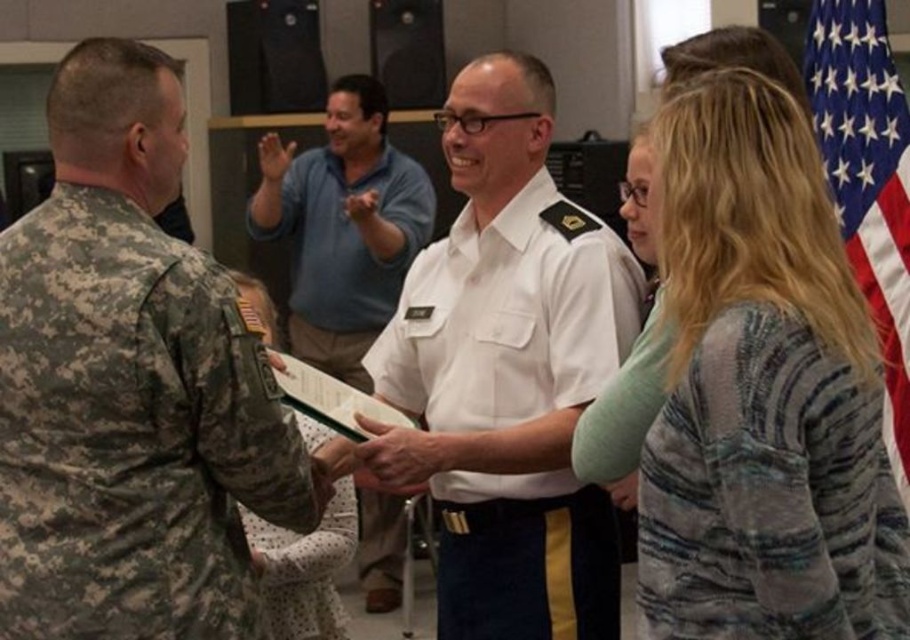
Who is positioned more to the right, white uniform shirt at center or smooth white paper at center?

smooth white paper at center is more to the right.

Is white uniform shirt at center to the right of smooth white paper at center from the viewer's perspective?

No, white uniform shirt at center is not to the right of smooth white paper at center.

Which is behind, point (352, 328) or point (364, 474)?

The point (352, 328) is behind.

Image resolution: width=910 pixels, height=640 pixels. I want to click on white uniform shirt at center, so click(x=342, y=227).

Between red fabric flag at right and smooth white paper at center, which one appears on the left side from the viewer's perspective?

smooth white paper at center is more to the left.

Between red fabric flag at right and smooth white paper at center, which one appears on the right side from the viewer's perspective?

red fabric flag at right is more to the right.

Who is more distant from viewer, (880,170) or (370,483)?

Positioned behind is point (880,170).

You are a GUI agent. You are given a task and a screenshot of the screen. Output one action in this format:
    pyautogui.click(x=<x>, y=<y>)
    Task: Click on the red fabric flag at right
    This screenshot has height=640, width=910.
    Given the screenshot: What is the action you would take?
    pyautogui.click(x=867, y=180)

Does white uniform at center have a greater width compared to red fabric flag at right?

Indeed, white uniform at center has a greater width compared to red fabric flag at right.

Does white uniform at center appear on the right side of red fabric flag at right?

No, white uniform at center is not to the right of red fabric flag at right.

What do you see at coordinates (508, 372) in the screenshot?
I see `white uniform at center` at bounding box center [508, 372].

Find the location of a particular element. The height and width of the screenshot is (640, 910). white uniform at center is located at coordinates (508, 372).